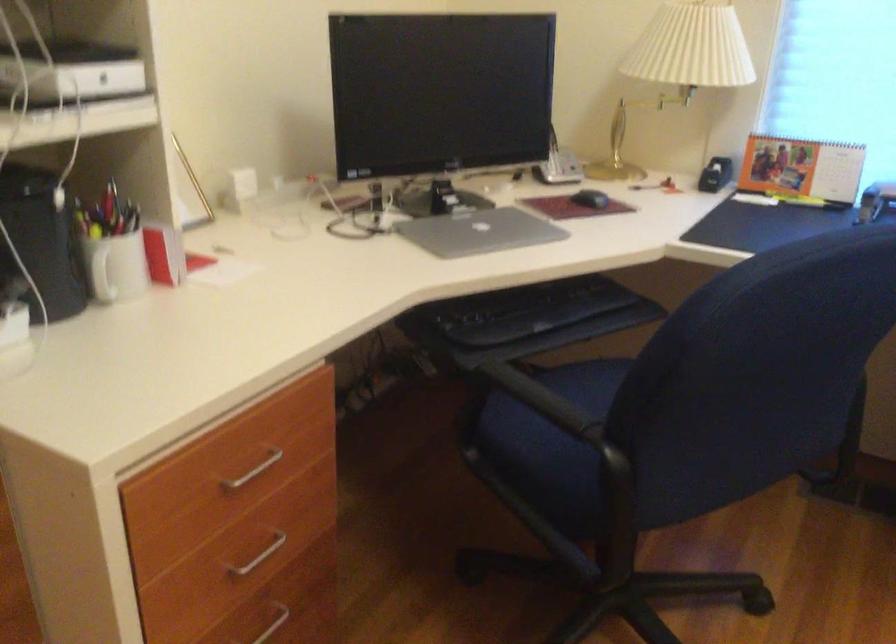
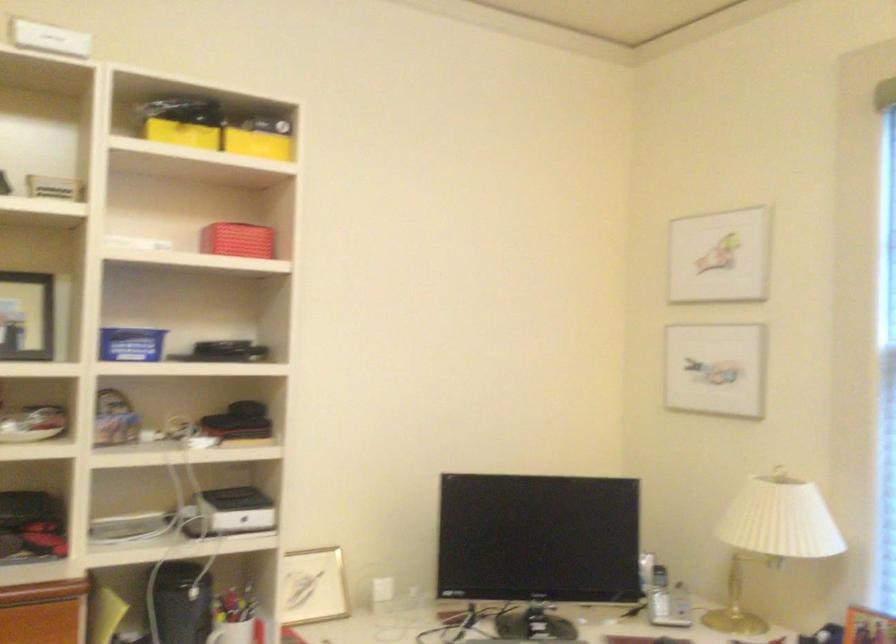
In the second image, find the point that corresponds to (711,67) in the first image.

(771, 538)